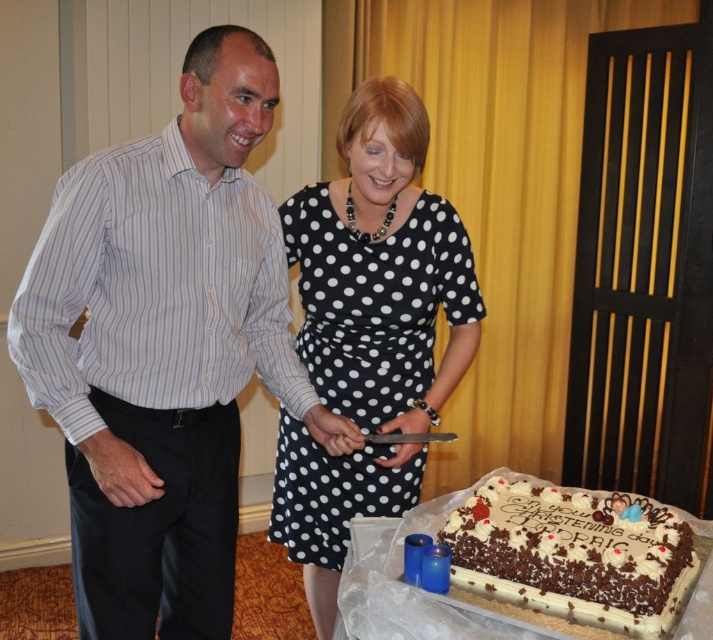
Can you confirm if white striped shirt at left is positioned to the left of black dotted dress at center?

Yes, white striped shirt at left is to the left of black dotted dress at center.

Can you confirm if white striped shirt at left is positioned to the right of black dotted dress at center?

Incorrect, white striped shirt at left is not on the right side of black dotted dress at center.

Does point (51, 202) come farther from viewer compared to point (287, 218)?

No, it is in front of (287, 218).

This screenshot has width=713, height=640. In order to click on white striped shirt at left in this screenshot , I will do `click(164, 348)`.

In the scene shown: Is white striped shirt at left shorter than white frosted chocolate cake at lower right?

No, white striped shirt at left is not shorter than white frosted chocolate cake at lower right.

Does point (202, 280) lie in front of point (600, 566)?

No, it is behind (600, 566).

Where is `white striped shirt at left`? This screenshot has width=713, height=640. white striped shirt at left is located at coordinates 164,348.

Does point (406, 236) come behind point (461, 579)?

Yes, point (406, 236) is farther from viewer.

Between point (302, 348) and point (548, 516), which one is positioned in front?

Positioned in front is point (548, 516).

You are a GUI agent. You are given a task and a screenshot of the screen. Output one action in this format:
    pyautogui.click(x=<x>, y=<y>)
    Task: Click on the black dotted dress at center
    
    Given the screenshot: What is the action you would take?
    pyautogui.click(x=381, y=269)